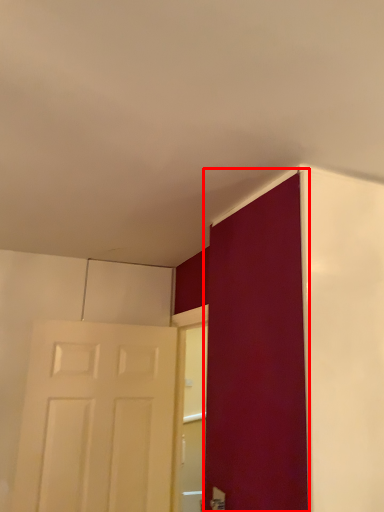
Question: Considering the relative positions of door (annotated by the red box) and door in the image provided, where is door (annotated by the red box) located with respect to the staircase?

Choices:
 (A) right
 (B) left

Answer: (A)